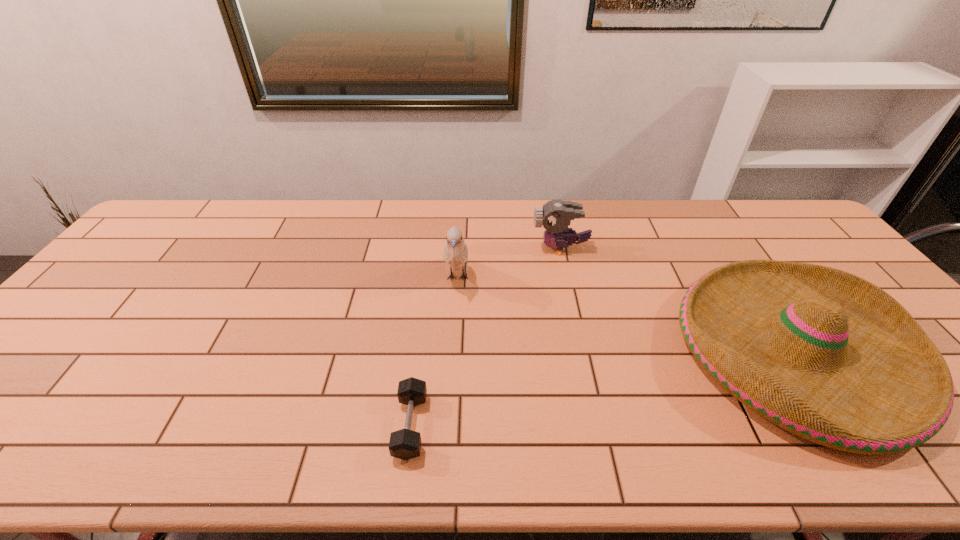
What are the coordinates of `vacant position located on the right of the leftmost object` in the screenshot? It's located at (498, 426).

Find the location of a particular element. Image resolution: width=960 pixels, height=540 pixels. object located at the near edge is located at coordinates (405, 444).

You are a GUI agent. You are given a task and a screenshot of the screen. Output one action in this format:
    pyautogui.click(x=<x>, y=<y>)
    Task: Click on the vacant area at the far edge
    This screenshot has width=960, height=540.
    Given the screenshot: What is the action you would take?
    pyautogui.click(x=218, y=212)

The height and width of the screenshot is (540, 960). Find the location of `vacant space at the near edge of the desktop`. vacant space at the near edge of the desktop is located at coordinates (250, 437).

In the image, there is a desktop. Where is `free space at the left edge`? free space at the left edge is located at coordinates (x=42, y=355).

Locate an element on the screen. vacant space at the far left corner of the desktop is located at coordinates (150, 233).

Find the location of a particular element. The width and height of the screenshot is (960, 540). free region at the far right corner of the desktop is located at coordinates (756, 199).

This screenshot has height=540, width=960. What are the coordinates of `empty space between the dumbbell and the farthest object` in the screenshot? It's located at (486, 338).

What are the coordinates of `free spot between the left bird and the second object from right to left` in the screenshot? It's located at (509, 264).

Identify the location of free space between the tallest object and the second object from right to left. (509, 264).